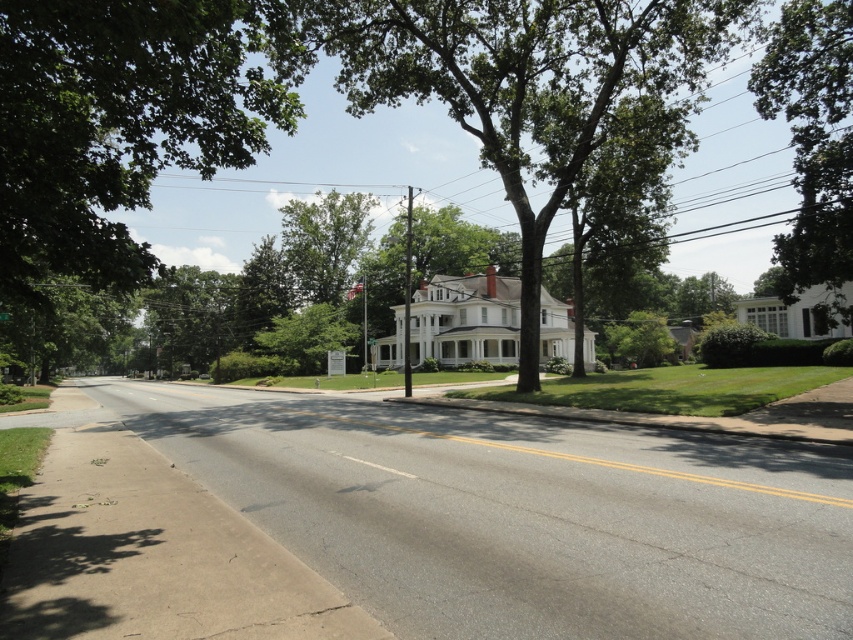
Question: Can you confirm if green leafy tree at center is thinner than green leafy tree at upper right?

Choices:
 (A) yes
 (B) no

Answer: (A)

Question: Can you confirm if green leafy tree at center is bigger than green leafy tree at upper right?

Choices:
 (A) yes
 (B) no

Answer: (A)

Question: Among these points, which one is farthest from the camera?

Choices:
 (A) (381, 29)
 (B) (782, 54)

Answer: (A)

Question: Among these objects, which one is nearest to the camera?

Choices:
 (A) green leafy tree at upper right
 (B) green leafy tree at center

Answer: (A)

Question: Is green leafy tree at center smaller than green leafy tree at upper right?

Choices:
 (A) no
 (B) yes

Answer: (A)